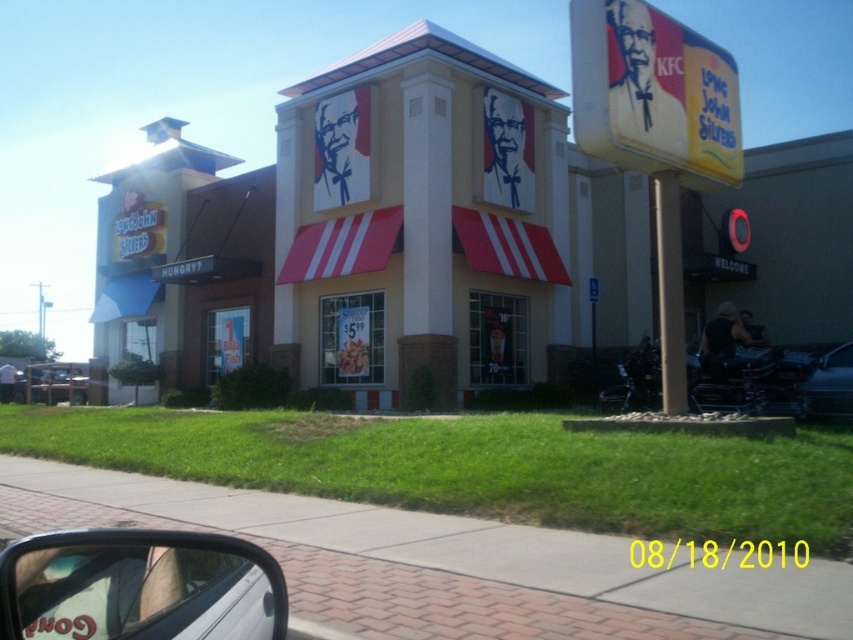
Question: Which object is farther from the camera taking this photo?

Choices:
 (A) metallic silver truck at lower left
 (B) matte black car window at lower left
 (C) black matte car at right

Answer: (A)

Question: Which point is farther from the camera taking this photo?

Choices:
 (A) (711, 563)
 (B) (810, 381)
 (C) (36, 387)
 (D) (262, 612)

Answer: (C)

Question: Does matte black car window at lower left have a larger size compared to metallic silver truck at lower left?

Choices:
 (A) yes
 (B) no

Answer: (B)

Question: Can you confirm if yellow paper date at center is bigger than black matte car at right?

Choices:
 (A) no
 (B) yes

Answer: (A)

Question: Among these points, which one is nearest to the camera?

Choices:
 (A) (703, 552)
 (B) (68, 576)
 (C) (834, 401)

Answer: (B)

Question: Is black matte car at right below metallic silver truck at lower left?

Choices:
 (A) no
 (B) yes

Answer: (A)